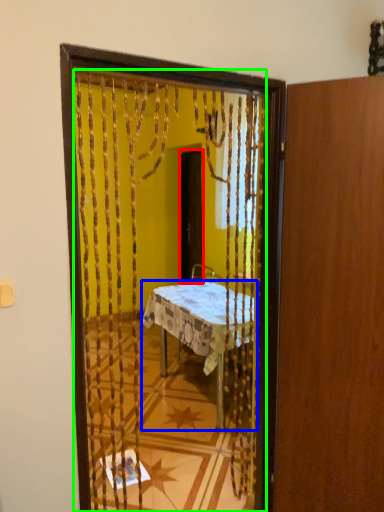
Question: Which object is positioned closest to screen door (highlighted by a red box)? Select from desk (highlighted by a blue box) and mirror (highlighted by a green box).

Choices:
 (A) desk
 (B) mirror

Answer: (A)